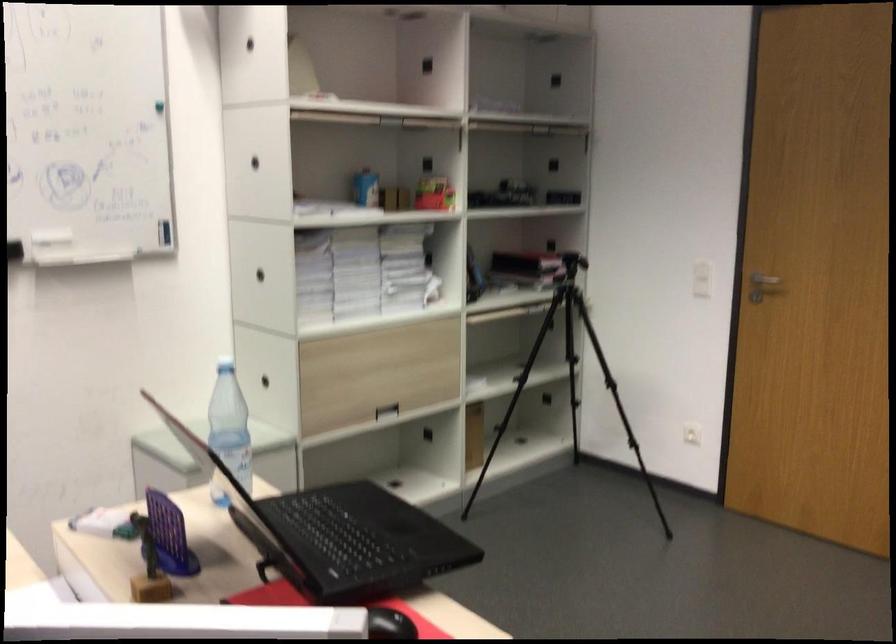
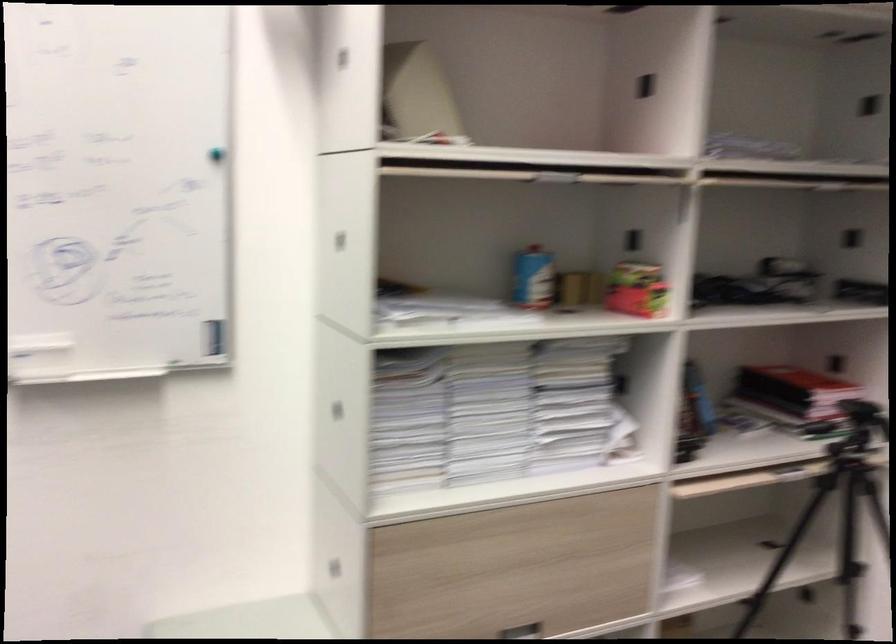
Where in the second image is the point corresponding to the point at 386,412 from the first image?

(522, 630)